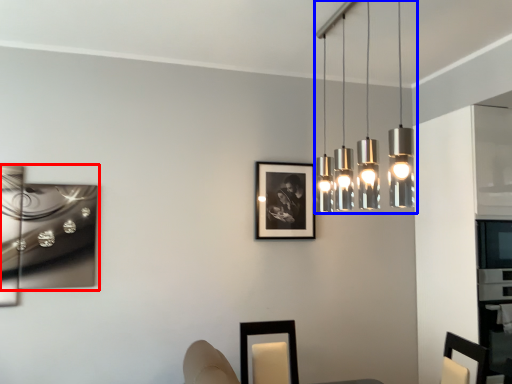
Question: Which object appears farthest to the camera in this image, picture frame (highlighted by a red box) or lamp (highlighted by a blue box)?

Choices:
 (A) picture frame
 (B) lamp

Answer: (A)